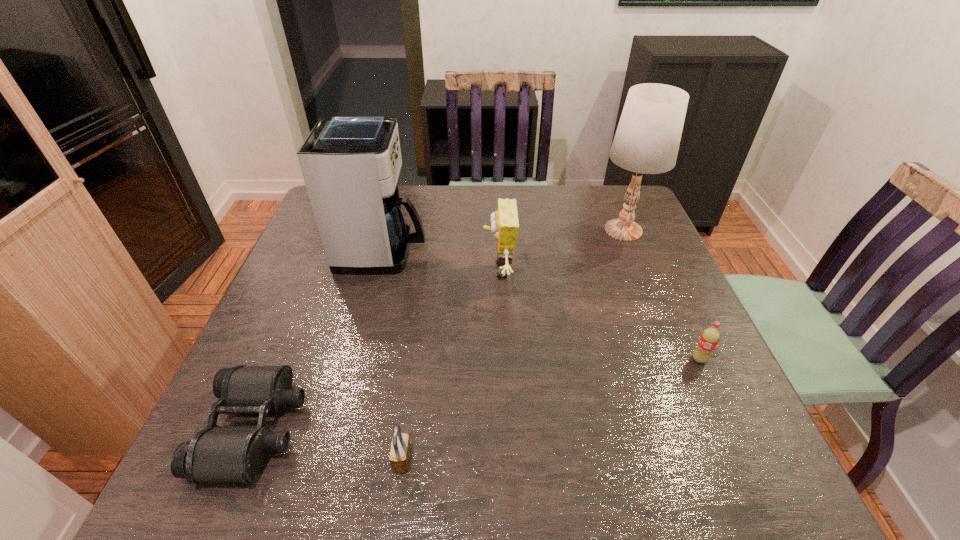
Where is `vacant region located 0.350m on the face of the third tallest object`? The image size is (960, 540). vacant region located 0.350m on the face of the third tallest object is located at coordinates (351, 272).

You are a GUI agent. You are given a task and a screenshot of the screen. Output one action in this format:
    pyautogui.click(x=<x>, y=<y>)
    Task: Click on the free space located 0.080m on the face of the third tallest object
    The image size is (960, 540).
    Given the screenshot: What is the action you would take?
    pyautogui.click(x=453, y=272)

Locate an element on the screen. This screenshot has width=960, height=540. free space located on the left of the soda is located at coordinates (645, 359).

You are a GUI agent. You are given a task and a screenshot of the screen. Output one action in this format:
    pyautogui.click(x=<x>, y=<y>)
    Task: Click on the free region located on the right of the padlock
    
    Given the screenshot: What is the action you would take?
    pyautogui.click(x=600, y=460)

The height and width of the screenshot is (540, 960). What are the coordinates of `blank space located 0.090m through the eyepieces of the binoculars` in the screenshot? It's located at (347, 428).

Image resolution: width=960 pixels, height=540 pixels. I want to click on object located in the far edge section of the desktop, so 647,139.

The height and width of the screenshot is (540, 960). Identify the location of padlock that is positioned at the near edge. (400, 452).

I want to click on binoculars that is at the near edge, so click(x=217, y=453).

Locate an element on the screen. The image size is (960, 540). coffee maker that is positioned at the left edge is located at coordinates (350, 164).

You are a GUI agent. You are given a task and a screenshot of the screen. Output one action in this format:
    pyautogui.click(x=<x>, y=<y>)
    Task: Click on the binoculars that is at the left edge
    This screenshot has height=540, width=960.
    Given the screenshot: What is the action you would take?
    pyautogui.click(x=217, y=453)